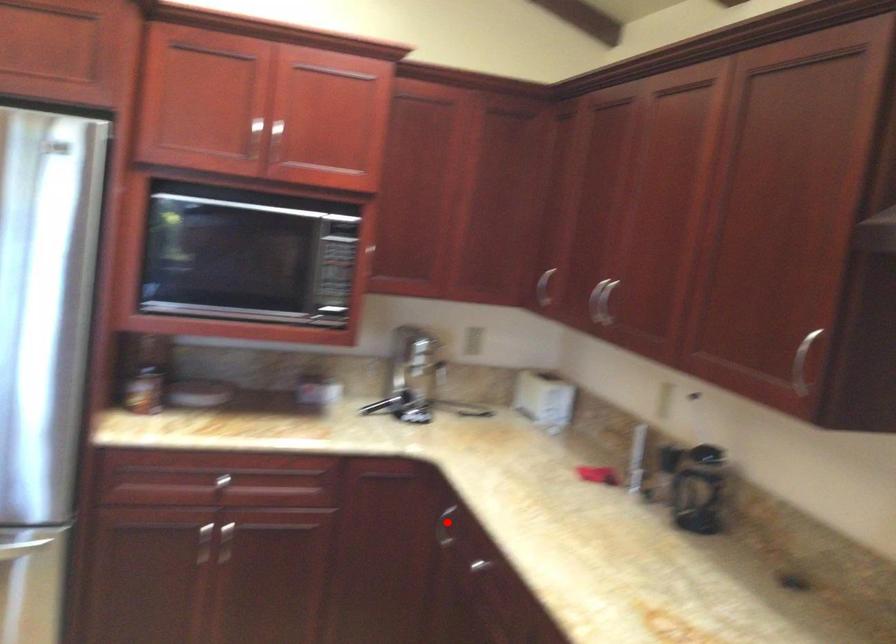
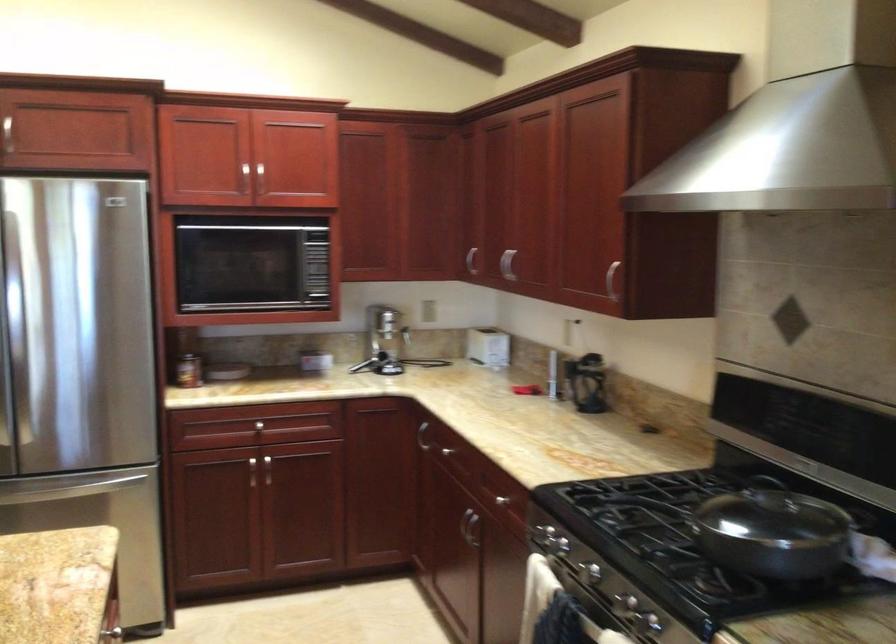
Question: A red point is marked in image1. In image2, is the corresponding 3D point closer to the camera or farther? Reply with the corresponding letter.

Choices:
 (A) The corresponding 3D point is closer.
 (B) The corresponding 3D point is farther.

Answer: (B)